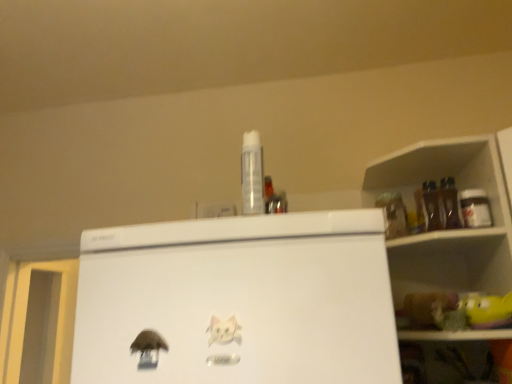
Question: Would you say matte plastic shelf at upper right is to the left or to the right of transparent plastic spray can at center, which ranks as the 2th bottle in right-to-left order, in the picture?

Choices:
 (A) right
 (B) left

Answer: (A)

Question: Is matte plastic shelf at upper right bigger or smaller than transparent plastic spray can at center, the 2th bottle positioned from the back?

Choices:
 (A) small
 (B) big

Answer: (B)

Question: Which is nearer to the metallic silver jar at upper right, acting as the first bottle starting from the back?

Choices:
 (A) matte plastic shelf at upper right
 (B) transparent plastic spray can at center, which is the 1th bottle from front to back
 (C) white paper cat at center

Answer: (A)

Question: Based on their relative distances, which object is farther from the transparent plastic spray can at center, which ranks as the 2th bottle in right-to-left order?

Choices:
 (A) metallic silver jar at upper right, the first bottle positioned from the right
 (B) white paper cat at center
 (C) matte plastic shelf at upper right

Answer: (C)